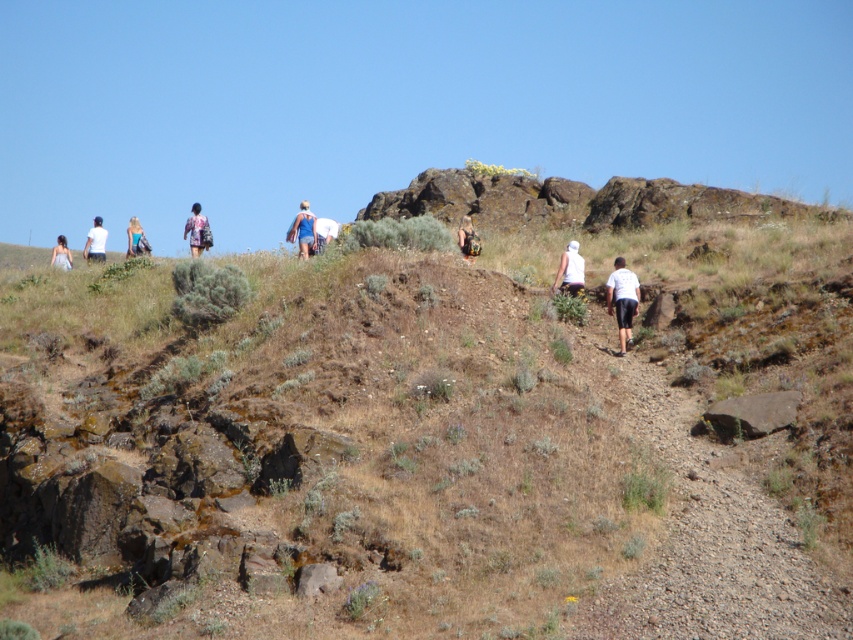
Question: Among these points, which one is nearest to the camera?

Choices:
 (A) (103, 257)
 (B) (556, 285)
 (C) (196, 225)
 (D) (68, 257)

Answer: (B)

Question: Considering the real-world distances, which object is farthest from the white matte shirt at center?

Choices:
 (A) matte black backpack at center
 (B) blue fabric dress at center
 (C) blue denim shorts at upper left
 (D) white matte shirt at lower right

Answer: (C)

Question: Does white matte shirt at lower right come behind white matte shirt at center?

Choices:
 (A) yes
 (B) no

Answer: (B)

Question: Is matte purple backpack at center closer to the viewer compared to white matte shirt at upper left?

Choices:
 (A) no
 (B) yes

Answer: (B)

Question: Is matte purple backpack at center positioned in front of white matte shirt at upper left?

Choices:
 (A) yes
 (B) no

Answer: (A)

Question: Estimate the real-world distances between objects in this image. Which object is farther from the blue denim shorts at upper left?

Choices:
 (A) matte black backpack at center
 (B) brown dirt path at center

Answer: (A)